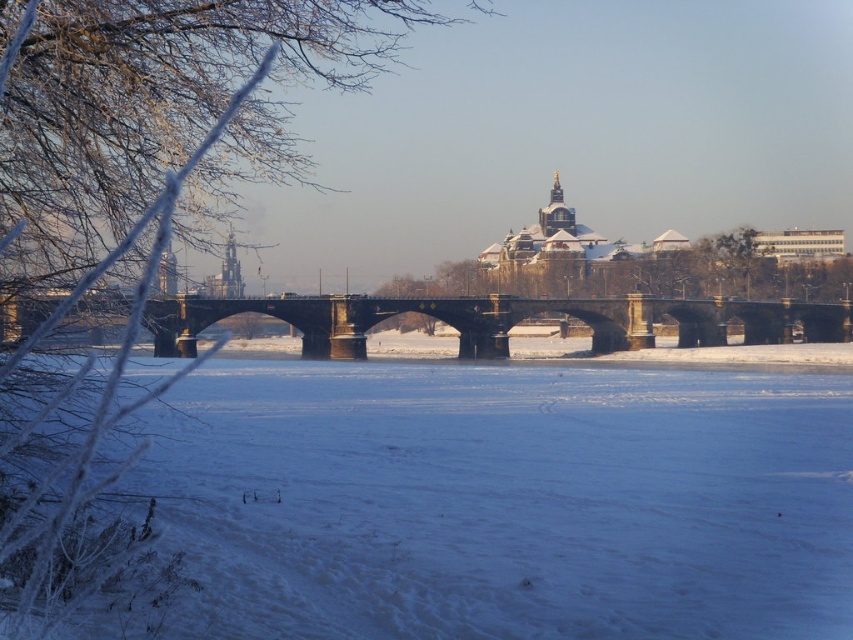
Question: Which point is closer to the camera?

Choices:
 (A) (321, 342)
 (B) (578, 604)

Answer: (B)

Question: Among these objects, which one is farthest from the camera?

Choices:
 (A) white powdery snow at center
 (B) stone bridge at center

Answer: (B)

Question: Does white powdery snow at center lie behind stone bridge at center?

Choices:
 (A) no
 (B) yes

Answer: (A)

Question: Can you confirm if white powdery snow at center is bigger than stone bridge at center?

Choices:
 (A) no
 (B) yes

Answer: (A)

Question: Is white powdery snow at center above stone bridge at center?

Choices:
 (A) no
 (B) yes

Answer: (A)